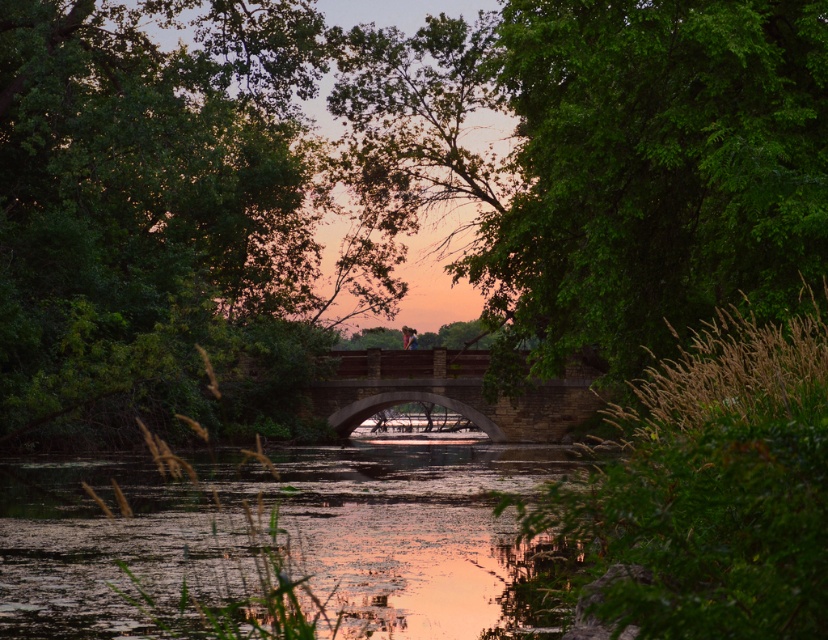
Question: Which object is the closest to the translucent green water at lower center?

Choices:
 (A) green leafy tree at center
 (B) brown stone bridge at center

Answer: (B)

Question: Which object appears farthest from the camera in this image?

Choices:
 (A) brown stone bridge at center
 (B) translucent green water at lower center
 (C) green leafy tree at center

Answer: (A)

Question: Can you confirm if green leafy tree at center is positioned to the right of translucent green water at lower center?

Choices:
 (A) no
 (B) yes

Answer: (A)

Question: Which point is closer to the camera?

Choices:
 (A) (551, 81)
 (B) (396, 388)

Answer: (A)

Question: Observing the image, what is the correct spatial positioning of translucent green water at lower center in reference to brown stone bridge at center?

Choices:
 (A) above
 (B) below

Answer: (B)

Question: Is translucent green water at lower center closer to camera compared to brown stone bridge at center?

Choices:
 (A) yes
 (B) no

Answer: (A)